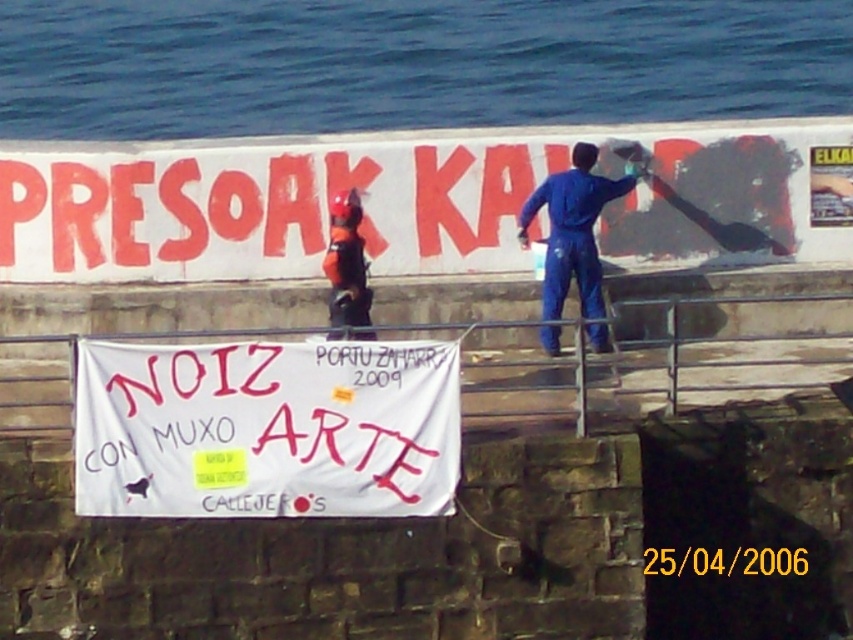
Is blue water at upper left further to the viewer compared to blue jumpsuit at upper center?

Yes, it is.

Can you confirm if blue water at upper left is shorter than blue jumpsuit at upper center?

No.

In order to click on blue water at upper left in this screenshot , I will do `click(410, 64)`.

Can you confirm if white paper banner at upper center is smaller than blue jumpsuit at upper center?

Yes, white paper banner at upper center is smaller than blue jumpsuit at upper center.

Is point (172, 276) positioned in front of point (564, 224)?

No, it is behind (564, 224).

Locate an element on the screen. The image size is (853, 640). white paper banner at upper center is located at coordinates (410, 200).

Between blue jumpsuit at upper center and orange fabric helmet at center, which one appears on the left side from the viewer's perspective?

Positioned to the left is orange fabric helmet at center.

Does blue jumpsuit at upper center appear on the left side of orange fabric helmet at center?

In fact, blue jumpsuit at upper center is to the right of orange fabric helmet at center.

Is point (582, 314) behind point (335, 209)?

Yes, it is.

In order to click on blue jumpsuit at upper center in this screenshot , I will do `click(575, 227)`.